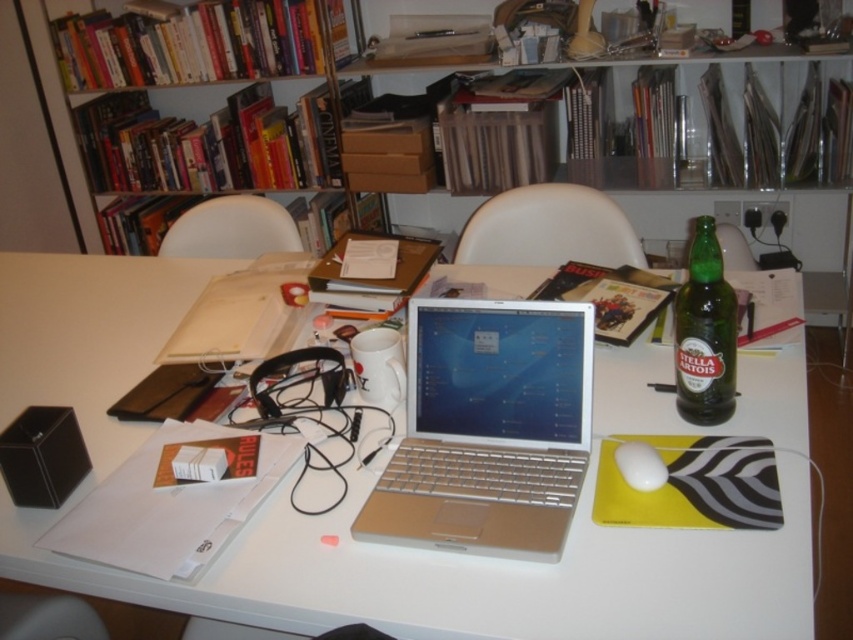
Can you confirm if white plastic table at center is wider than white matte mouse at center?

Indeed, white plastic table at center has a greater width compared to white matte mouse at center.

Does white plastic table at center appear on the right side of white matte mouse at center?

In fact, white plastic table at center is to the left of white matte mouse at center.

Does point (44, 403) lie behind point (656, 486)?

Yes, it is behind point (656, 486).

Image resolution: width=853 pixels, height=640 pixels. What are the coordinates of `white plastic table at center` in the screenshot? It's located at (358, 508).

Does white plastic table at center have a greater width compared to green glass bottle at right?

Indeed, white plastic table at center has a greater width compared to green glass bottle at right.

Measure the distance between white plastic table at center and camera.

A distance of 32.07 inches exists between white plastic table at center and camera.

The height and width of the screenshot is (640, 853). What are the coordinates of `white plastic table at center` in the screenshot? It's located at (358, 508).

The width and height of the screenshot is (853, 640). I want to click on white plastic table at center, so click(x=358, y=508).

Can you confirm if wooden bookshelf at upper left is positioned above white matte mouse at center?

Correct, wooden bookshelf at upper left is located above white matte mouse at center.

Does wooden bookshelf at upper left appear under white matte mouse at center?

Actually, wooden bookshelf at upper left is above white matte mouse at center.

This screenshot has height=640, width=853. Describe the element at coordinates (199, 44) in the screenshot. I see `wooden bookshelf at upper left` at that location.

Where is `wooden bookshelf at upper left`? Image resolution: width=853 pixels, height=640 pixels. wooden bookshelf at upper left is located at coordinates (199, 44).